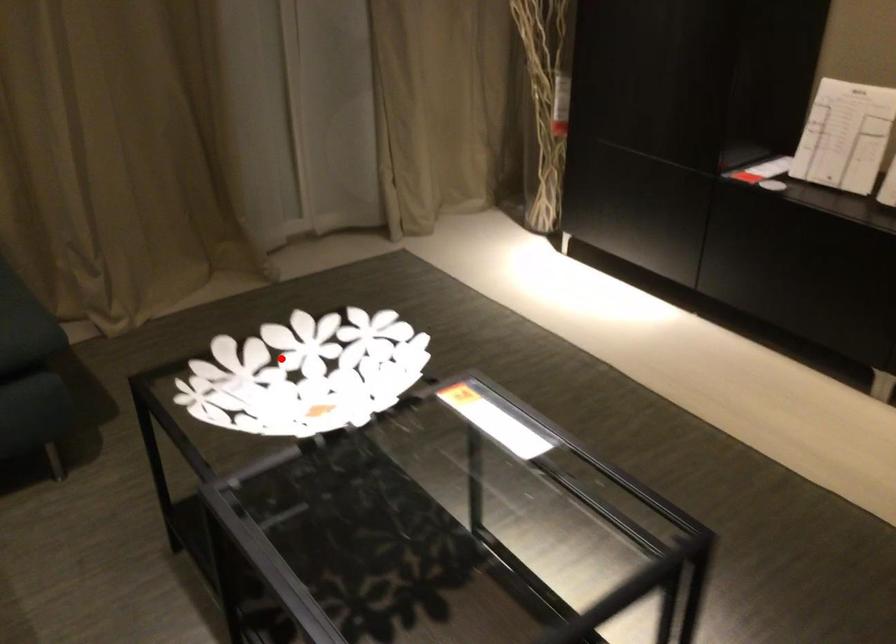
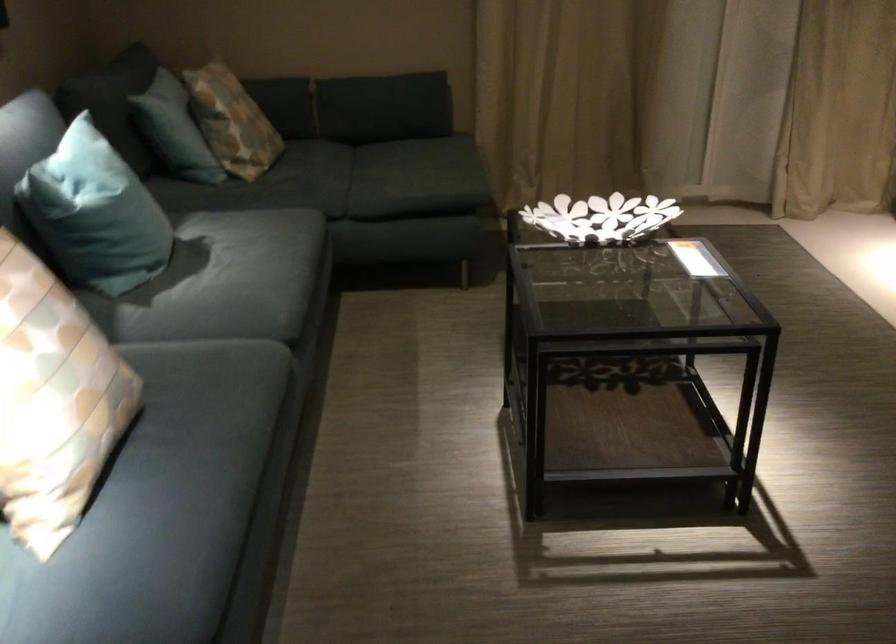
Question: I am providing you with two images of the same scene from different viewpoints. Image1 has a red point marked. In image2, the corresponding 3D location appears at what relative position? Reply with the corresponding letter.

Choices:
 (A) Closer
 (B) Farther

Answer: (B)